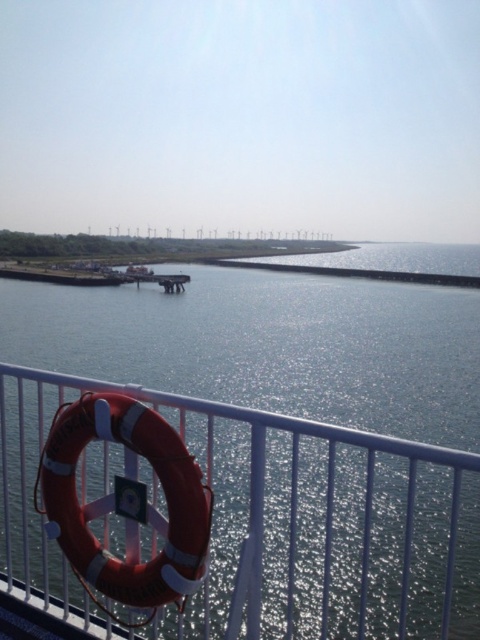
Is point (48, 593) positioned after point (136, 416)?

That is True.

What do you see at coordinates (224, 516) in the screenshot? This screenshot has height=640, width=480. I see `white metal fence at lower center` at bounding box center [224, 516].

Is point (275, 577) positioned before point (199, 518)?

No.

At what (x,y) coordinates should I click in order to perform the action: click on white metal fence at lower center. Please return your answer as a coordinate pair (x, y). The height and width of the screenshot is (640, 480). Looking at the image, I should click on (224, 516).